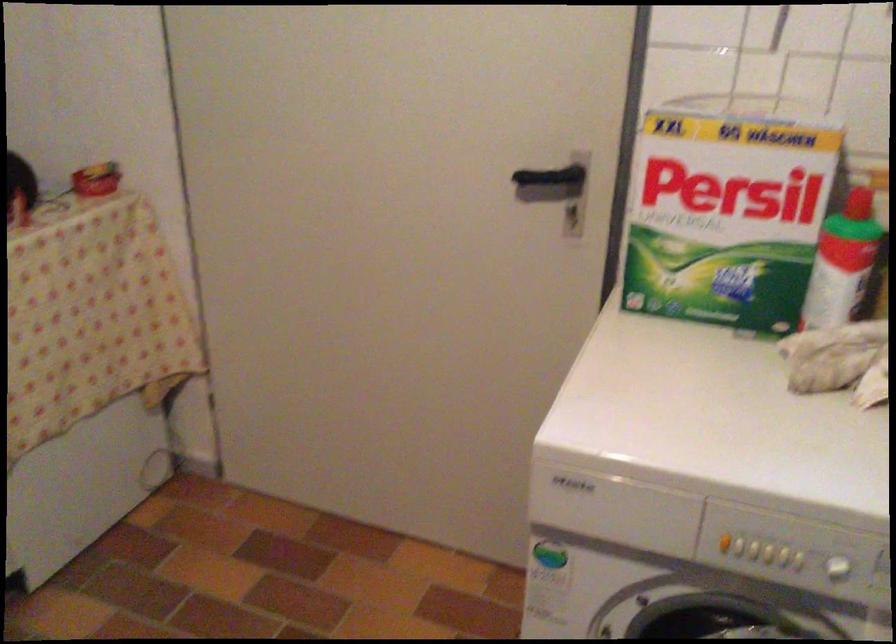
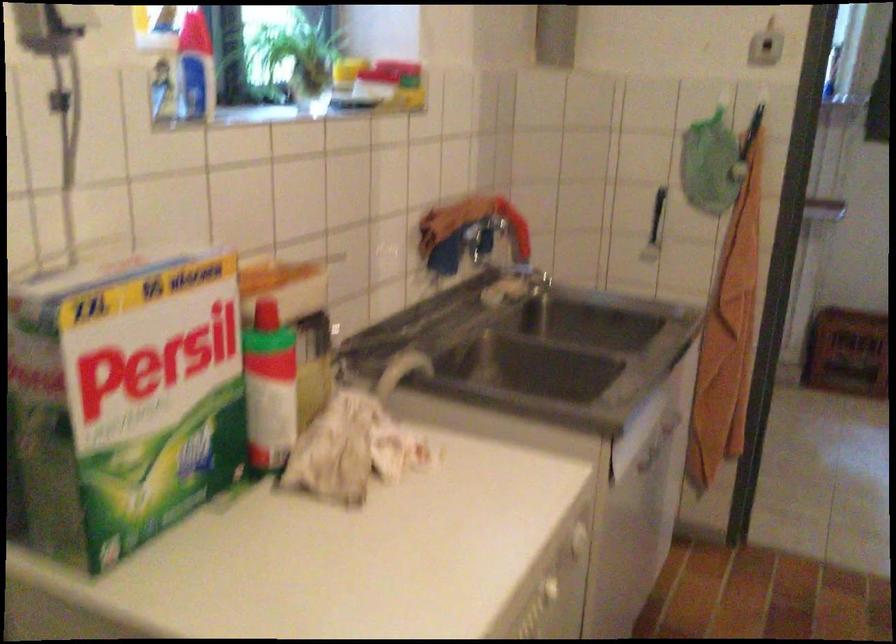
Question: Based on the continuous images, in which direction is the camera rotating? Reply with the corresponding letter.

Choices:
 (A) Left
 (B) Right
 (C) Up
 (D) Down

Answer: (B)